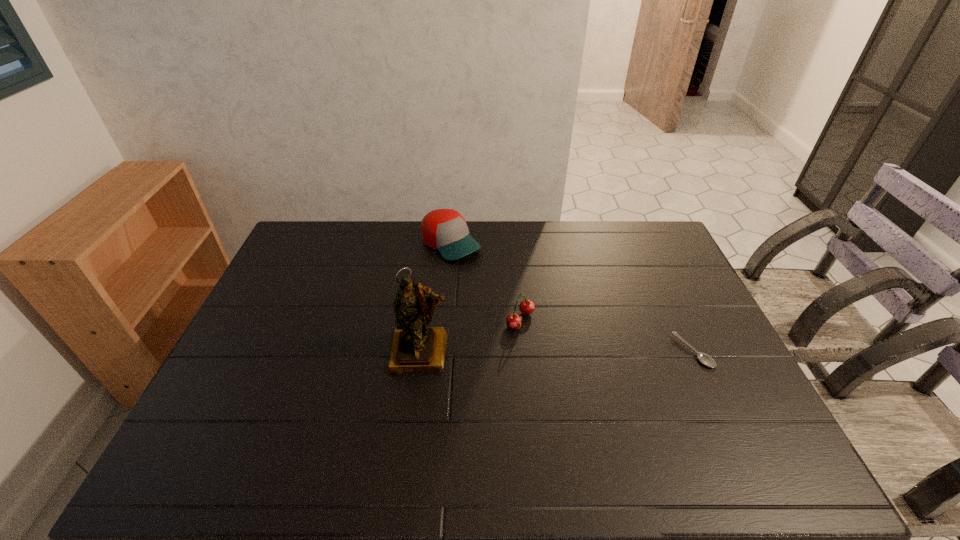
You are a GUI agent. You are given a task and a screenshot of the screen. Output one action in this format:
    pyautogui.click(x=<x>, y=<y>)
    Task: Click on the third closest object to the soupspoon
    This screenshot has height=540, width=960.
    Given the screenshot: What is the action you would take?
    pyautogui.click(x=445, y=230)

This screenshot has height=540, width=960. I want to click on blank space that satisfies the following two spatial constraints: 1. on the front side of the second object from right to left; 2. on the left side of the baseball cap, so click(x=444, y=320).